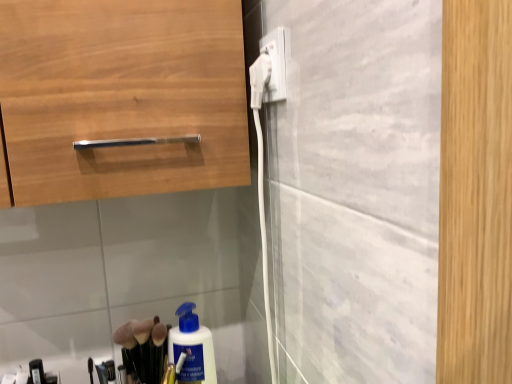
Image resolution: width=512 pixels, height=384 pixels. Describe the element at coordinates (259, 79) in the screenshot. I see `white plastic plug at upper center, marked as the first electric outlet in a left-to-right arrangement` at that location.

Where is `white plastic plug at upper center, marked as the first electric outlet in a left-to-right arrangement`? The height and width of the screenshot is (384, 512). white plastic plug at upper center, marked as the first electric outlet in a left-to-right arrangement is located at coordinates (259, 79).

Where is `white plastic plug at upper center, the first electric outlet when ordered from right to left`? This screenshot has width=512, height=384. white plastic plug at upper center, the first electric outlet when ordered from right to left is located at coordinates (275, 65).

The height and width of the screenshot is (384, 512). Describe the element at coordinates (275, 65) in the screenshot. I see `white plastic plug at upper center, which is the second electric outlet from left to right` at that location.

The height and width of the screenshot is (384, 512). What are the coordinates of `white plastic plug at upper center, marked as the first electric outlet in a left-to-right arrangement` in the screenshot? It's located at (259, 79).

Would you say white plastic plug at upper center, placed as the 2th electric outlet when sorted from right to left, is to the left or to the right of white plastic plug at upper center, the first electric outlet when ordered from right to left, in the picture?

→ From the image, it's evident that white plastic plug at upper center, placed as the 2th electric outlet when sorted from right to left, is to the left of white plastic plug at upper center, the first electric outlet when ordered from right to left.

Is white plastic plug at upper center, placed as the 2th electric outlet when sorted from right to left, in front of white plastic plug at upper center, which is the second electric outlet from left to right?

No, white plastic plug at upper center, placed as the 2th electric outlet when sorted from right to left, is further to the viewer.

Which point is more distant from viewer, [260,57] or [278,93]?

Positioned behind is point [260,57].

Consider the image. From the image's perspective, which one is positioned lower, white plastic plug at upper center, marked as the first electric outlet in a left-to-right arrangement, or white plastic plug at upper center, which is the second electric outlet from left to right?

white plastic plug at upper center, marked as the first electric outlet in a left-to-right arrangement, is shown below in the image.

From a real-world perspective, is white plastic plug at upper center, marked as the first electric outlet in a left-to-right arrangement, located higher than white plastic plug at upper center, the first electric outlet when ordered from right to left?

No.

Does white plastic plug at upper center, marked as the first electric outlet in a left-to-right arrangement, have a greater width compared to white plastic plug at upper center, which is the second electric outlet from left to right?

In fact, white plastic plug at upper center, marked as the first electric outlet in a left-to-right arrangement, might be narrower than white plastic plug at upper center, which is the second electric outlet from left to right.

Who is taller, white plastic plug at upper center, placed as the 2th electric outlet when sorted from right to left, or white plastic plug at upper center, the first electric outlet when ordered from right to left?

white plastic plug at upper center, the first electric outlet when ordered from right to left, is taller.

In terms of size, does white plastic plug at upper center, marked as the first electric outlet in a left-to-right arrangement, appear bigger or smaller than white plastic plug at upper center, which is the second electric outlet from left to right?

In the image, white plastic plug at upper center, marked as the first electric outlet in a left-to-right arrangement, appears to be smaller than white plastic plug at upper center, which is the second electric outlet from left to right.

Is white plastic plug at upper center, placed as the 2th electric outlet when sorted from right to left, outside of white plastic plug at upper center, the first electric outlet when ordered from right to left?

white plastic plug at upper center, placed as the 2th electric outlet when sorted from right to left, lies outside white plastic plug at upper center, the first electric outlet when ordered from right to left,'s area.

Are white plastic plug at upper center, marked as the first electric outlet in a left-to-right arrangement, and white plastic plug at upper center, the first electric outlet when ordered from right to left, making contact?

Yes, white plastic plug at upper center, marked as the first electric outlet in a left-to-right arrangement, is right next to white plastic plug at upper center, the first electric outlet when ordered from right to left, and making contact.

Is white plastic plug at upper center, marked as the first electric outlet in a left-to-right arrangement, oriented away from white plastic plug at upper center, the first electric outlet when ordered from right to left?

No, white plastic plug at upper center, marked as the first electric outlet in a left-to-right arrangement,'s orientation is not away from white plastic plug at upper center, the first electric outlet when ordered from right to left.

Identify the location of electric outlet below the white plastic plug at upper center, the first electric outlet when ordered from right to left (from a real-world perspective). This screenshot has height=384, width=512. (259, 79).

From the picture: Which object is positioned more to the right, white plastic plug at upper center, which is the second electric outlet from left to right, or white plastic plug at upper center, marked as the first electric outlet in a left-to-right arrangement?

From the viewer's perspective, white plastic plug at upper center, which is the second electric outlet from left to right, appears more on the right side.

Considering the positions of objects white plastic plug at upper center, which is the second electric outlet from left to right, and white plastic plug at upper center, marked as the first electric outlet in a left-to-right arrangement, in the image provided, who is in front, white plastic plug at upper center, which is the second electric outlet from left to right, or white plastic plug at upper center, marked as the first electric outlet in a left-to-right arrangement,?

white plastic plug at upper center, which is the second electric outlet from left to right, is closer to the camera.

Which is less distant, (282, 40) or (254, 98)?

Point (282, 40).

From the image's perspective, who appears lower, white plastic plug at upper center, which is the second electric outlet from left to right, or white plastic plug at upper center, placed as the 2th electric outlet when sorted from right to left?

white plastic plug at upper center, placed as the 2th electric outlet when sorted from right to left, is shown below in the image.

From a real-world perspective, who is located higher, white plastic plug at upper center, the first electric outlet when ordered from right to left, or white plastic plug at upper center, placed as the 2th electric outlet when sorted from right to left?

white plastic plug at upper center, the first electric outlet when ordered from right to left, from a real-world perspective.

Does white plastic plug at upper center, the first electric outlet when ordered from right to left, have a lesser width compared to white plastic plug at upper center, marked as the first electric outlet in a left-to-right arrangement?

No.

From their relative heights in the image, would you say white plastic plug at upper center, the first electric outlet when ordered from right to left, is taller or shorter than white plastic plug at upper center, marked as the first electric outlet in a left-to-right arrangement?

Considering their sizes, white plastic plug at upper center, the first electric outlet when ordered from right to left, has more height than white plastic plug at upper center, marked as the first electric outlet in a left-to-right arrangement.

Between white plastic plug at upper center, which is the second electric outlet from left to right, and white plastic plug at upper center, marked as the first electric outlet in a left-to-right arrangement, which one has larger size?

With larger size is white plastic plug at upper center, which is the second electric outlet from left to right.

Is white plastic plug at upper center, which is the second electric outlet from left to right, spatially inside white plastic plug at upper center, marked as the first electric outlet in a left-to-right arrangement, or outside of it?

white plastic plug at upper center, which is the second electric outlet from left to right, is not inside white plastic plug at upper center, marked as the first electric outlet in a left-to-right arrangement, it's outside.

Are white plastic plug at upper center, which is the second electric outlet from left to right, and white plastic plug at upper center, placed as the 2th electric outlet when sorted from right to left, located far from each other?

No, there isn't a large distance between white plastic plug at upper center, which is the second electric outlet from left to right, and white plastic plug at upper center, placed as the 2th electric outlet when sorted from right to left.

Is white plastic plug at upper center, the first electric outlet when ordered from right to left, looking in the opposite direction of white plastic plug at upper center, marked as the first electric outlet in a left-to-right arrangement?

No.

Can you tell me how much white plastic plug at upper center, the first electric outlet when ordered from right to left, and white plastic plug at upper center, placed as the 2th electric outlet when sorted from right to left, differ in facing direction?

They differ by 0.00555 degrees in their facing directions.

Identify the location of electric outlet directly beneath the white plastic plug at upper center, which is the second electric outlet from left to right (from a real-world perspective). (259, 79).

At what (x,y) coordinates should I click in order to perform the action: click on electric outlet on the left of the white plastic plug at upper center, the first electric outlet when ordered from right to left. Please return your answer as a coordinate pair (x, y). The width and height of the screenshot is (512, 384). Looking at the image, I should click on (259, 79).

Where is `electric outlet below the white plastic plug at upper center, the first electric outlet when ordered from right to left (from a real-world perspective)`? The width and height of the screenshot is (512, 384). electric outlet below the white plastic plug at upper center, the first electric outlet when ordered from right to left (from a real-world perspective) is located at coordinates (259, 79).